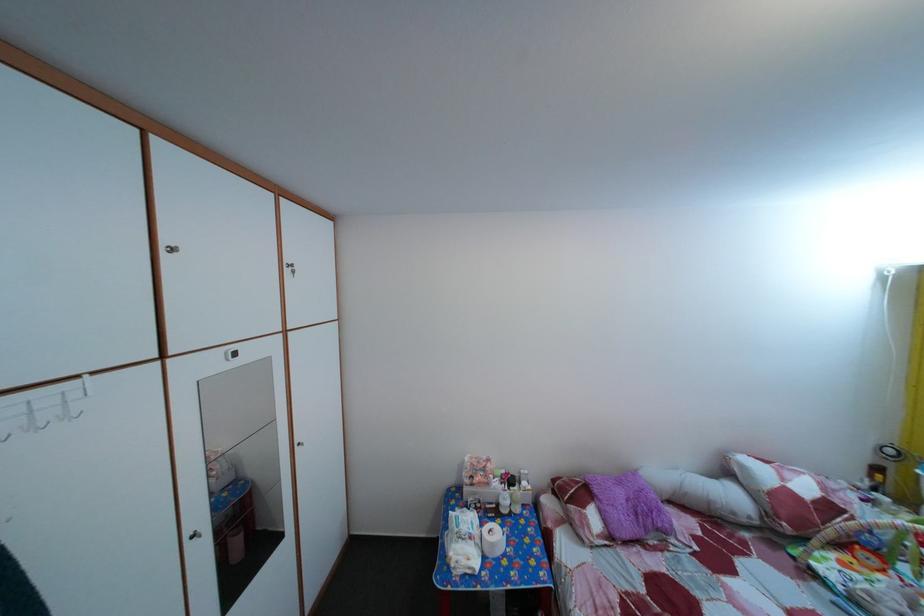
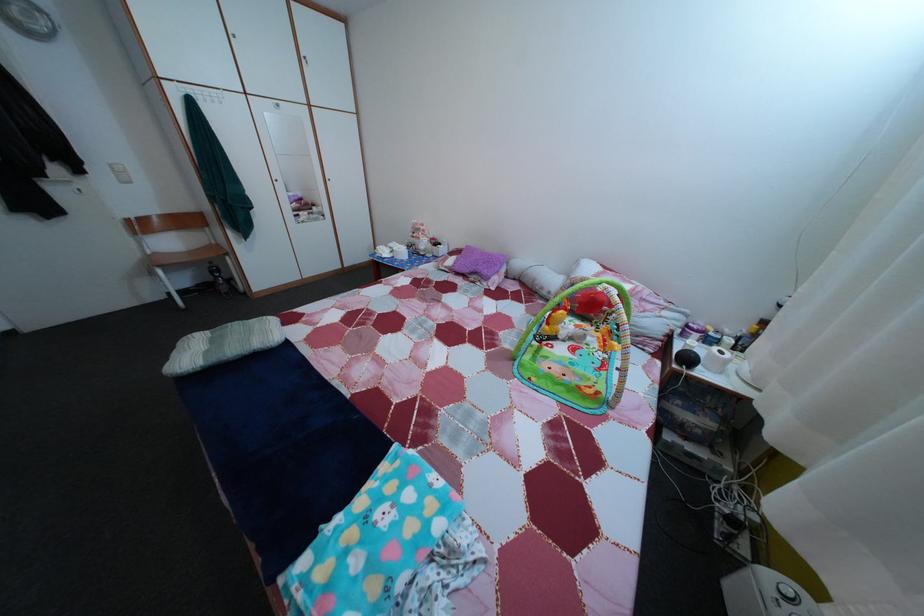
Locate, in the second image, the point that corresponds to pixel 754 528 in the first image.

(553, 301)